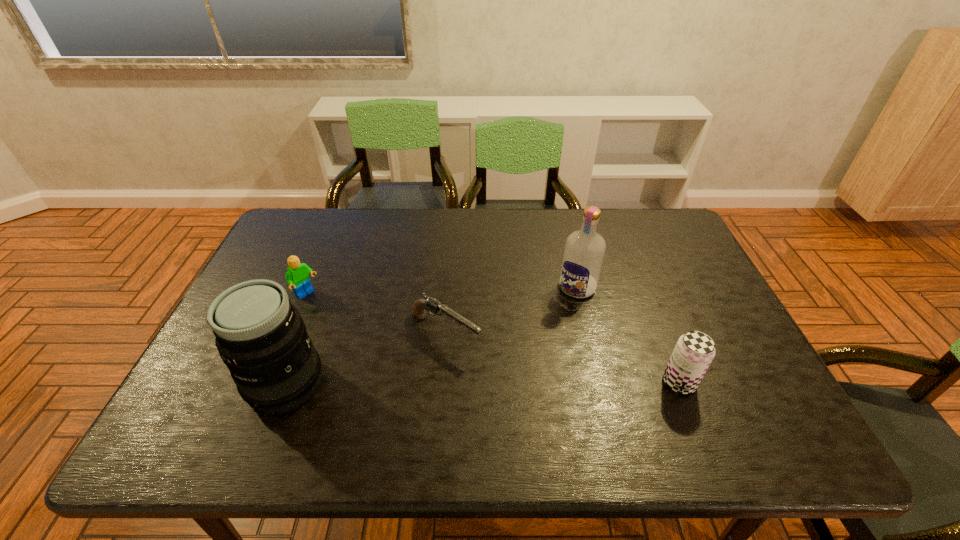
At what (x,y) coordinates should I click in order to perform the action: click on vacant space on the desktop that is between the telephoto lens and the beer can and is positioned on the label of the vodka. Please return your answer as a coordinate pair (x, y). Image resolution: width=960 pixels, height=540 pixels. Looking at the image, I should click on (508, 383).

Image resolution: width=960 pixels, height=540 pixels. Identify the location of vacant space on the desktop that is between the telephoto lens and the rightmost object and is positioned on the face of the Lego. (424, 383).

This screenshot has height=540, width=960. Identify the location of free spot on the desktop that is between the telephoto lens and the beer can and is positioned aiming along the barrel of the third object from right to left. (519, 383).